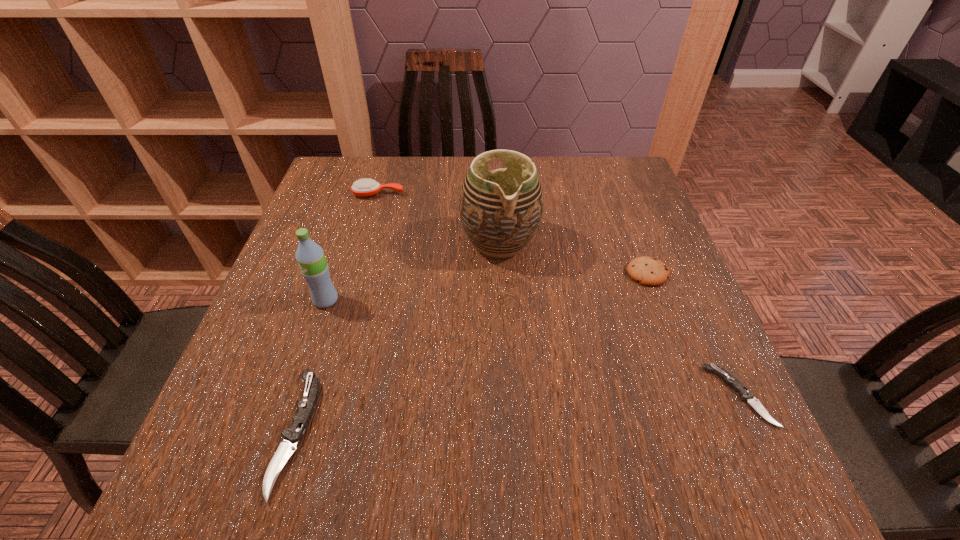
Identify the location of free space between the left pocketknife and the pottery. (397, 337).

Locate an element on the screen. This screenshot has width=960, height=540. free point between the fourth tallest object and the fourth farthest object is located at coordinates (487, 287).

At what (x,y) coordinates should I click in order to perform the action: click on unoccupied area between the fourth tallest object and the fourth object from left to right. Please return your answer as a coordinate pair (x, y). This screenshot has height=540, width=960. Looking at the image, I should click on (573, 258).

You are a GUI agent. You are given a task and a screenshot of the screen. Output one action in this format:
    pyautogui.click(x=<x>, y=<y>)
    Task: Click on the unoccupied position between the cookie and the third object from right to left
    
    Given the screenshot: What is the action you would take?
    pyautogui.click(x=573, y=258)

What are the coordinates of `unoccupied position between the left pocketknife and the right pocketknife` in the screenshot? It's located at (517, 414).

You are a GUI agent. You are given a task and a screenshot of the screen. Output one action in this format:
    pyautogui.click(x=<x>, y=<y>)
    Task: Click on the free space that is in between the shorter pocketknife and the pottery
    
    Given the screenshot: What is the action you would take?
    pyautogui.click(x=620, y=319)

Identify the location of empty location between the farthest object and the fifth tallest object. (337, 313).

You are a GUI agent. You are given a task and a screenshot of the screen. Output one action in this format:
    pyautogui.click(x=<x>, y=<y>)
    Task: Click on the vacant point located between the third object from right to left and the taller pocketknife
    
    Given the screenshot: What is the action you would take?
    pyautogui.click(x=397, y=337)

Locate an element on the screen. The width and height of the screenshot is (960, 540). vacant space in between the third tallest object and the third nearest object is located at coordinates (352, 247).

Find the location of a particular element. object that stands as the fifth closest to the farthest object is located at coordinates (746, 395).